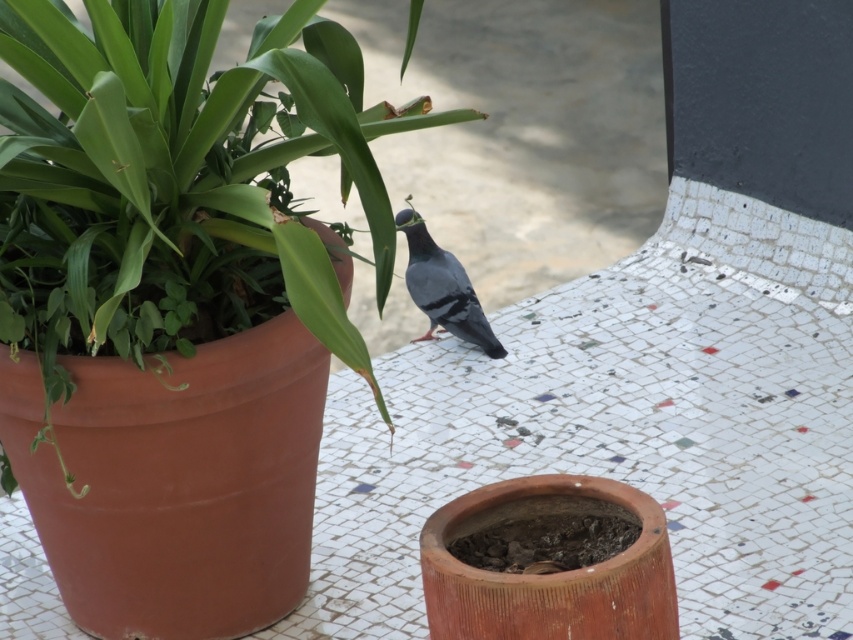
Question: Can you confirm if green matte pot at center is wider than gray matte pigeon at center?

Choices:
 (A) no
 (B) yes

Answer: (B)

Question: Which point appears closest to the camera in this image?

Choices:
 (A) (x=0, y=337)
 (B) (x=457, y=300)

Answer: (A)

Question: Observing the image, what is the correct spatial positioning of green matte pot at center in reference to gray matte pigeon at center?

Choices:
 (A) above
 (B) below

Answer: (A)

Question: Does green matte pot at center lie in front of gray matte pigeon at center?

Choices:
 (A) no
 (B) yes

Answer: (B)